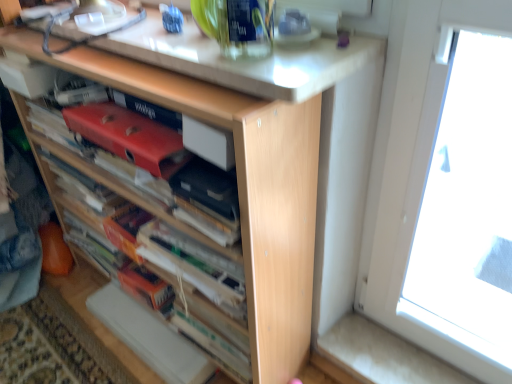
In order to click on matte black paperback book at center, positioned as the 1th paperback book in right-to-left order in this screenshot , I will do `click(208, 190)`.

What do you see at coordinates (129, 193) in the screenshot? The image size is (512, 384). I see `wooden book at center` at bounding box center [129, 193].

I want to click on matte black paperback book at center, the 2th paperback book from the left, so click(208, 190).

Measure the distance between matte red paperback book at center, positioned as the 1th paperback book in left-to-right order, and matte black paperback book at center, positioned as the 1th paperback book in right-to-left order.

The distance of matte red paperback book at center, positioned as the 1th paperback book in left-to-right order, from matte black paperback book at center, positioned as the 1th paperback book in right-to-left order, is 12.39 centimeters.

Which object is closer to the camera, matte red paperback book at center, the 2th paperback book positioned from the right, or matte black paperback book at center, the 2th paperback book from the left?

matte black paperback book at center, the 2th paperback book from the left, is in front.

From a real-world perspective, between matte red paperback book at center, positioned as the 1th paperback book in left-to-right order, and matte black paperback book at center, positioned as the 1th paperback book in right-to-left order, who is vertically higher?

From a 3D spatial view, matte red paperback book at center, positioned as the 1th paperback book in left-to-right order, is above.

Which object is positioned more to the left, matte red paperback book at center, positioned as the 1th paperback book in left-to-right order, or matte black paperback book at center, the 2th paperback book from the left?

From the viewer's perspective, matte red paperback book at center, positioned as the 1th paperback book in left-to-right order, appears more on the left side.

Looking at the image, does wooden book at center seem bigger or smaller compared to matte black paperback book at center, the 2th paperback book from the left?

Clearly, wooden book at center is larger in size than matte black paperback book at center, the 2th paperback book from the left.

Is wooden book at center positioned far away from matte black paperback book at center, positioned as the 1th paperback book in right-to-left order?

No, wooden book at center is in close proximity to matte black paperback book at center, positioned as the 1th paperback book in right-to-left order.

From a real-world perspective, which is physically above, wooden book at center or matte black paperback book at center, the 2th paperback book from the left?

matte black paperback book at center, the 2th paperback book from the left, from a real-world perspective.

Is matte black paperback book at center, positioned as the 1th paperback book in right-to-left order, taller than wooden book at center?

No, matte black paperback book at center, positioned as the 1th paperback book in right-to-left order, is not taller than wooden book at center.

How many degrees apart are the facing directions of matte black paperback book at center, positioned as the 1th paperback book in right-to-left order, and wooden book at center?

They differ by 0.646 degrees in their facing directions.

From the image's perspective, which one is positioned lower, matte black paperback book at center, positioned as the 1th paperback book in right-to-left order, or wooden book at center?

wooden book at center.

From the image's perspective, is wooden book at center on top of white glossy countertop at upper center?

No, from the image's perspective, wooden book at center is not on top of white glossy countertop at upper center.

Who is shorter, wooden book at center or white glossy countertop at upper center?

Standing shorter between the two is white glossy countertop at upper center.

Are wooden book at center and white glossy countertop at upper center beside each other?

wooden book at center and white glossy countertop at upper center are clearly separated.

Where is `book located on the left of white glossy countertop at upper center`? This screenshot has height=384, width=512. book located on the left of white glossy countertop at upper center is located at coordinates (129, 193).

Looking at this image, considering the positions of objects matte black paperback book at center, positioned as the 1th paperback book in right-to-left order, and matte red paperback book at center, positioned as the 1th paperback book in left-to-right order, in the image provided, who is in front, matte black paperback book at center, positioned as the 1th paperback book in right-to-left order, or matte red paperback book at center, positioned as the 1th paperback book in left-to-right order,?

matte black paperback book at center, positioned as the 1th paperback book in right-to-left order.

Is matte black paperback book at center, the 2th paperback book from the left, taller or shorter than matte red paperback book at center, positioned as the 1th paperback book in left-to-right order?

Considering their sizes, matte black paperback book at center, the 2th paperback book from the left, has less height than matte red paperback book at center, positioned as the 1th paperback book in left-to-right order.

From a real-world perspective, is matte black paperback book at center, the 2th paperback book from the left, positioned above or below matte red paperback book at center, positioned as the 1th paperback book in left-to-right order?

In terms of real-world spatial position, matte black paperback book at center, the 2th paperback book from the left, is below matte red paperback book at center, positioned as the 1th paperback book in left-to-right order.

Is matte black paperback book at center, positioned as the 1th paperback book in right-to-left order, to the right of matte red paperback book at center, positioned as the 1th paperback book in left-to-right order, from the viewer's perspective?

Indeed, matte black paperback book at center, positioned as the 1th paperback book in right-to-left order, is positioned on the right side of matte red paperback book at center, positioned as the 1th paperback book in left-to-right order.

Consider the image. From a real-world perspective, which object stands above the other?

matte red paperback book at center, the 2th paperback book positioned from the right, is physically above.

Is matte red paperback book at center, the 2th paperback book positioned from the right, located outside wooden book at center?

No, matte red paperback book at center, the 2th paperback book positioned from the right, is inside wooden book at center's boundary.

Is matte red paperback book at center, the 2th paperback book positioned from the right, turned away from wooden book at center?

Yes.

Could you tell me if wooden book at center is facing matte red paperback book at center, the 2th paperback book positioned from the right?

Yes, wooden book at center is facing matte red paperback book at center, the 2th paperback book positioned from the right.

Which is less distant, [174,223] or [119,114]?

Point [174,223].

From a real-world perspective, is wooden book at center physically located above or below matte red paperback book at center, the 2th paperback book positioned from the right?

Clearly, from a real-world perspective, wooden book at center is below matte red paperback book at center, the 2th paperback book positioned from the right.

Does wooden book at center have a greater height compared to matte red paperback book at center, positioned as the 1th paperback book in left-to-right order?

Yes.

This screenshot has width=512, height=384. I want to click on paperback book to the left of matte black paperback book at center, positioned as the 1th paperback book in right-to-left order, so click(129, 137).

Locate an element on the screen. book that is in front of the matte black paperback book at center, the 2th paperback book from the left is located at coordinates (129, 193).

Based on their spatial positions, is white glossy countertop at upper center or matte red paperback book at center, the 2th paperback book positioned from the right, further from wooden book at center?

white glossy countertop at upper center.

Which object lies further to the anchor point white glossy countertop at upper center, matte black paperback book at center, positioned as the 1th paperback book in right-to-left order, or wooden book at center?

Based on the image, wooden book at center appears to be further to white glossy countertop at upper center.

Looking at the image, which one is located closer to wooden book at center, matte black paperback book at center, positioned as the 1th paperback book in right-to-left order, or matte red paperback book at center, positioned as the 1th paperback book in left-to-right order?

The object closer to wooden book at center is matte red paperback book at center, positioned as the 1th paperback book in left-to-right order.

Estimate the real-world distances between objects in this image. Which object is closer to matte black paperback book at center, positioned as the 1th paperback book in right-to-left order, white glossy countertop at upper center or matte red paperback book at center, positioned as the 1th paperback book in left-to-right order?

matte red paperback book at center, positioned as the 1th paperback book in left-to-right order, is positioned closer to the anchor matte black paperback book at center, positioned as the 1th paperback book in right-to-left order.

Estimate the real-world distances between objects in this image. Which object is further from wooden book at center, matte red paperback book at center, the 2th paperback book positioned from the right, or white glossy countertop at upper center?

The object further to wooden book at center is white glossy countertop at upper center.

Which object lies nearer to the anchor point matte red paperback book at center, the 2th paperback book positioned from the right, wooden book at center or white glossy countertop at upper center?

The object closer to matte red paperback book at center, the 2th paperback book positioned from the right, is white glossy countertop at upper center.

In the scene shown: Which object lies further to the anchor point matte black paperback book at center, positioned as the 1th paperback book in right-to-left order, white glossy countertop at upper center or wooden book at center?

Based on the image, wooden book at center appears to be further to matte black paperback book at center, positioned as the 1th paperback book in right-to-left order.

Estimate the real-world distances between objects in this image. Which object is closer to matte red paperback book at center, positioned as the 1th paperback book in left-to-right order, white glossy countertop at upper center or matte black paperback book at center, positioned as the 1th paperback book in right-to-left order?

Based on the image, matte black paperback book at center, positioned as the 1th paperback book in right-to-left order, appears to be nearer to matte red paperback book at center, positioned as the 1th paperback book in left-to-right order.

Where is `paperback book that lies between white glossy countertop at upper center and matte black paperback book at center, the 2th paperback book from the left, from top to bottom`? The image size is (512, 384). paperback book that lies between white glossy countertop at upper center and matte black paperback book at center, the 2th paperback book from the left, from top to bottom is located at coordinates (129, 137).

Locate an element on the screen. Image resolution: width=512 pixels, height=384 pixels. paperback book situated between wooden book at center and matte black paperback book at center, positioned as the 1th paperback book in right-to-left order, from left to right is located at coordinates (129, 137).